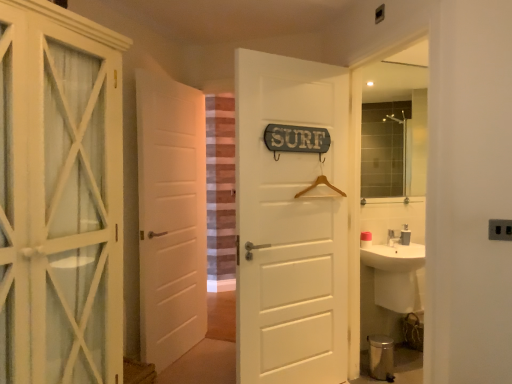
Question: Is metallic silver toilet bowl at lower right facing towards white wooden cabinet at left, the 3th door when ordered from back to front?

Choices:
 (A) no
 (B) yes

Answer: (A)

Question: Is metallic silver toilet bowl at lower right touching white wooden cabinet at left, which appears as the third door when viewed from the right?

Choices:
 (A) yes
 (B) no

Answer: (B)

Question: Is white wooden cabinet at left, the first door when ordered from front to back, completely or partially inside metallic silver toilet bowl at lower right?

Choices:
 (A) yes
 (B) no

Answer: (B)

Question: Can you confirm if metallic silver toilet bowl at lower right is smaller than white wooden cabinet at left, the first door when ordered from front to back?

Choices:
 (A) yes
 (B) no

Answer: (A)

Question: From the image's perspective, is metallic silver toilet bowl at lower right above white wooden cabinet at left, the first door when ordered from front to back?

Choices:
 (A) no
 (B) yes

Answer: (A)

Question: Considering the relative sizes of metallic silver toilet bowl at lower right and white wooden cabinet at left, the 3th door when ordered from back to front, in the image provided, is metallic silver toilet bowl at lower right wider than white wooden cabinet at left, the 3th door when ordered from back to front,?

Choices:
 (A) no
 (B) yes

Answer: (A)

Question: Is striped fabric curtain at center looking in the opposite direction of white matte door at center, the first door when ordered from right to left?

Choices:
 (A) no
 (B) yes

Answer: (A)

Question: Is striped fabric curtain at center to the left of white matte door at center, the first door when ordered from right to left, from the viewer's perspective?

Choices:
 (A) no
 (B) yes

Answer: (B)

Question: From the image's perspective, is striped fabric curtain at center over white matte door at center, which is the 2th door in back-to-front order?

Choices:
 (A) yes
 (B) no

Answer: (A)

Question: Considering the relative sizes of striped fabric curtain at center and white matte door at center, the first door when ordered from right to left, in the image provided, is striped fabric curtain at center bigger than white matte door at center, the first door when ordered from right to left,?

Choices:
 (A) yes
 (B) no

Answer: (B)

Question: Is striped fabric curtain at center at the right side of white matte door at center, the 2th door viewed from the front?

Choices:
 (A) yes
 (B) no

Answer: (B)

Question: Would you say striped fabric curtain at center is a long distance from white matte door at center, which is the 2th door in back-to-front order?

Choices:
 (A) yes
 (B) no

Answer: (A)

Question: Is the position of white matte door at center, the first door viewed from the back, more distant than that of matte glass mirror at upper right?

Choices:
 (A) yes
 (B) no

Answer: (B)